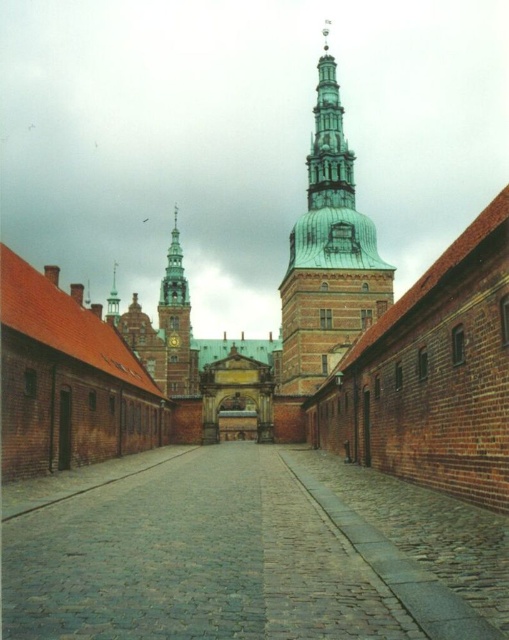
Question: Among these objects, which one is farthest from the camera?

Choices:
 (A) metallic gold clock at center
 (B) cobblestone alley at center

Answer: (A)

Question: Can you confirm if cobblestone alley at center is bigger than green copper tower at center?

Choices:
 (A) no
 (B) yes

Answer: (A)

Question: Which point is farther to the camera?

Choices:
 (A) (64, 520)
 (B) (331, 259)
 (C) (169, 244)

Answer: (C)

Question: Can you confirm if cobblestone alley at center is wider than green copper spire at upper center?

Choices:
 (A) no
 (B) yes

Answer: (B)

Question: Estimate the real-world distances between objects in this image. Which object is closer to the green copper spire at upper center?

Choices:
 (A) green copper roof at center
 (B) cobblestone alley at center
 (C) metallic gold clock at center
 (D) green copper tower at center

Answer: (D)

Question: Does green copper roof at center appear on the left side of metallic gold clock at center?

Choices:
 (A) no
 (B) yes

Answer: (A)